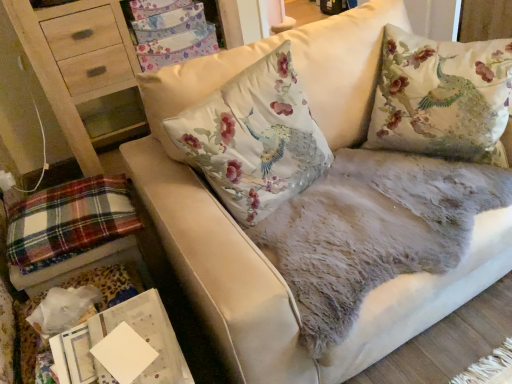
Question: From a real-world perspective, is white paper at lower left located higher than plaid fabric at lower left?

Choices:
 (A) yes
 (B) no

Answer: (A)

Question: Considering the relative sizes of white paper at lower left and plaid fabric at lower left in the image provided, is white paper at lower left shorter than plaid fabric at lower left?

Choices:
 (A) no
 (B) yes

Answer: (B)

Question: From the image's perspective, is white paper at lower left below plaid fabric at lower left?

Choices:
 (A) yes
 (B) no

Answer: (A)

Question: Is white paper at lower left facing away from plaid fabric at lower left?

Choices:
 (A) no
 (B) yes

Answer: (A)

Question: Is white paper at lower left beside plaid fabric at lower left?

Choices:
 (A) no
 (B) yes

Answer: (A)

Question: Is white paper at lower left in front of plaid fabric at lower left?

Choices:
 (A) no
 (B) yes

Answer: (B)

Question: Considering the relative sizes of floral fabric cushion at center, the 1th pillow when ordered from left to right, and plaid fabric at lower left in the image provided, is floral fabric cushion at center, the 1th pillow when ordered from left to right, thinner than plaid fabric at lower left?

Choices:
 (A) no
 (B) yes

Answer: (B)

Question: Would you say plaid fabric at lower left is part of floral fabric cushion at center, the 1th pillow when ordered from left to right,'s contents?

Choices:
 (A) yes
 (B) no

Answer: (B)

Question: Is plaid fabric at lower left at the back of floral fabric cushion at center, positioned as the second pillow in right-to-left order?

Choices:
 (A) no
 (B) yes

Answer: (A)

Question: Does floral fabric cushion at center, positioned as the second pillow in right-to-left order, turn towards plaid fabric at lower left?

Choices:
 (A) no
 (B) yes

Answer: (A)

Question: Is floral fabric cushion at center, positioned as the second pillow in right-to-left order, positioned in front of plaid fabric at lower left?

Choices:
 (A) no
 (B) yes

Answer: (B)

Question: Does floral fabric cushion at center, the 1th pillow when ordered from left to right, have a greater width compared to plaid fabric at lower left?

Choices:
 (A) no
 (B) yes

Answer: (A)

Question: Is plaid fabric at lower left facing towards floral fabric cushion at center, positioned as the second pillow in right-to-left order?

Choices:
 (A) no
 (B) yes

Answer: (A)